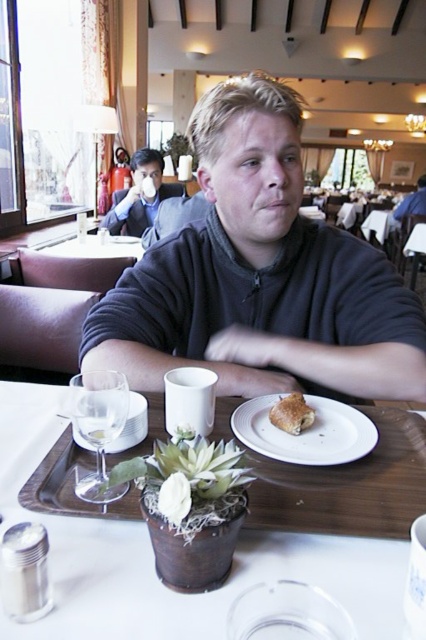
Question: Which is farther from the clear glass wine glass at lower left?

Choices:
 (A) golden flaky pastry at center
 (B) dark gray sweater at center
 (C) clear glass at lower left
 (D) white matte plate at lower center

Answer: (B)

Question: Estimate the real-world distances between objects in this image. Which object is farther from the golden flaky pastry at center?

Choices:
 (A) matte black shirt at upper center
 (B) clear glass at lower left
 (C) wooden tray at lower center
 (D) white matte plate at lower center

Answer: (A)

Question: Is matte black shirt at upper center above white matte tray at center?

Choices:
 (A) no
 (B) yes

Answer: (B)

Question: Is white matte plate at lower center to the left of clear glass wine glass at lower left from the viewer's perspective?

Choices:
 (A) yes
 (B) no

Answer: (B)

Question: In this image, where is white matte plate at lower center located relative to clear glass wine glass at lower left?

Choices:
 (A) above
 (B) below

Answer: (B)

Question: Which object appears closest to the camera in this image?

Choices:
 (A) clear glass at lower left
 (B) matte black shirt at upper center

Answer: (A)